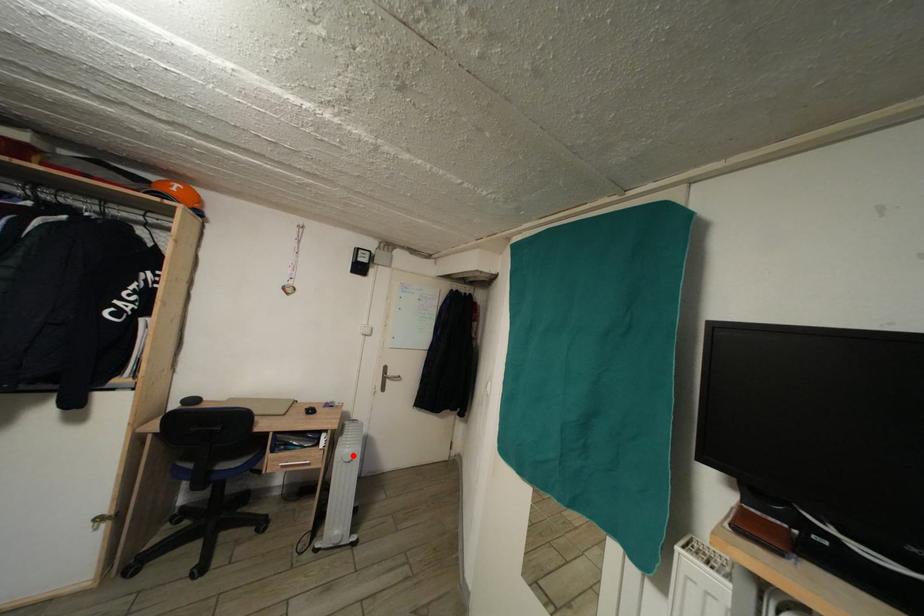
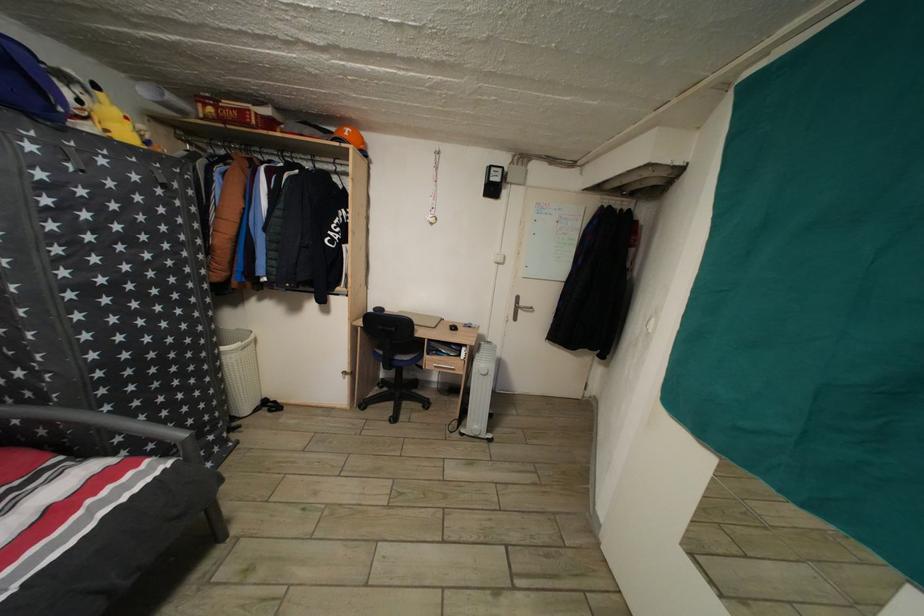
Question: I am providing you with two images of the same scene from different viewpoints. Image1 has a red point marked. In image2, the corresponding 3D location appears at what relative position? Reply with the corresponding letter.

Choices:
 (A) Closer
 (B) Farther

Answer: (B)